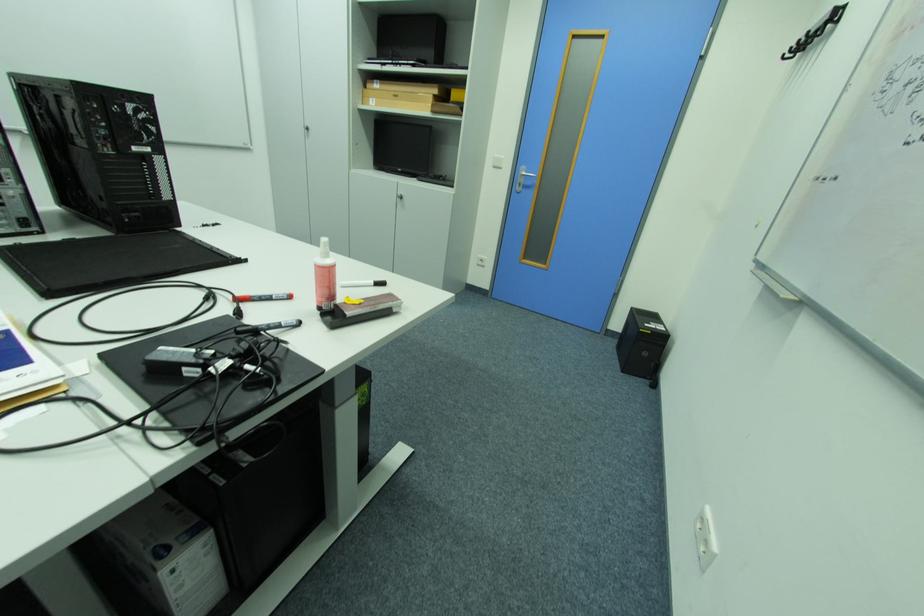
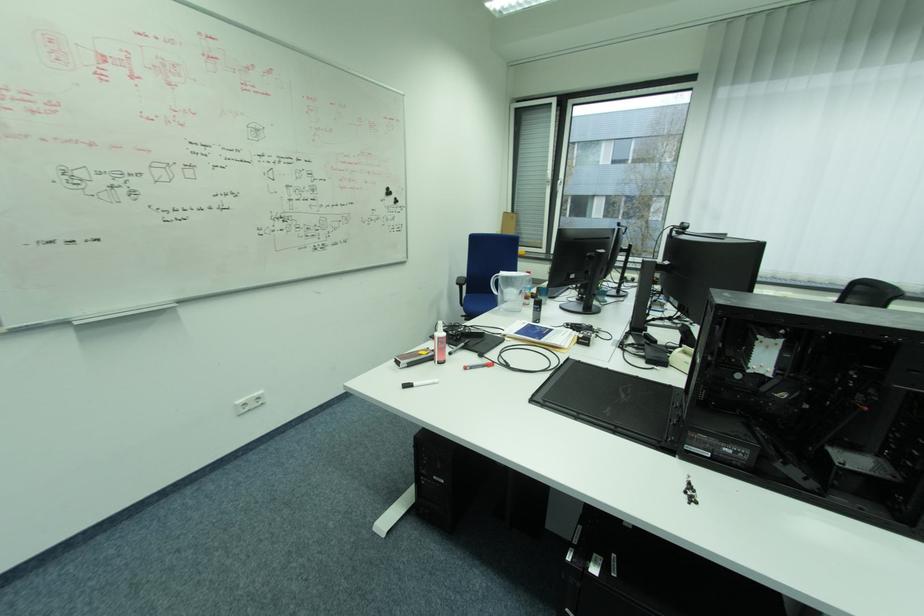
Locate, in the second image, the point that corresponds to pixel 298 298 in the first image.

(472, 369)